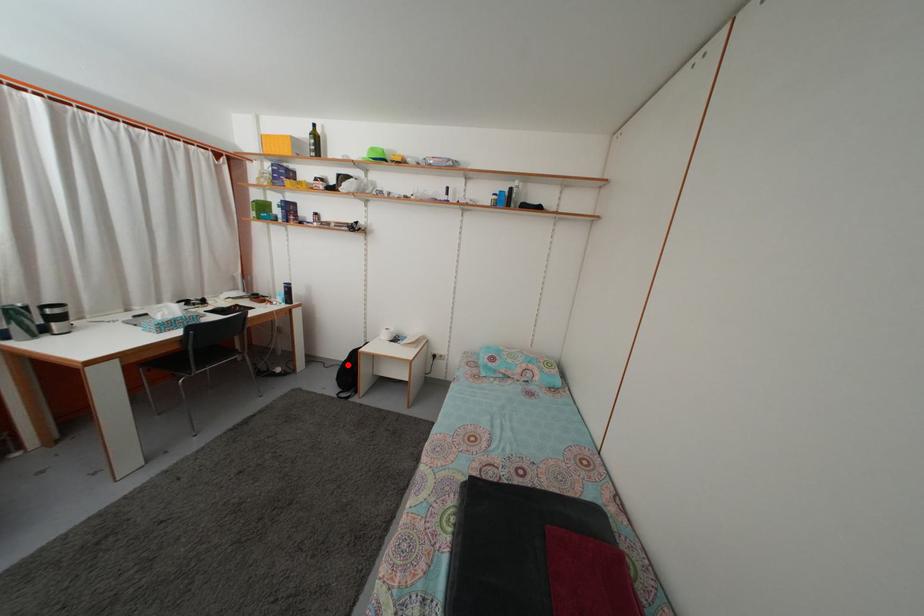
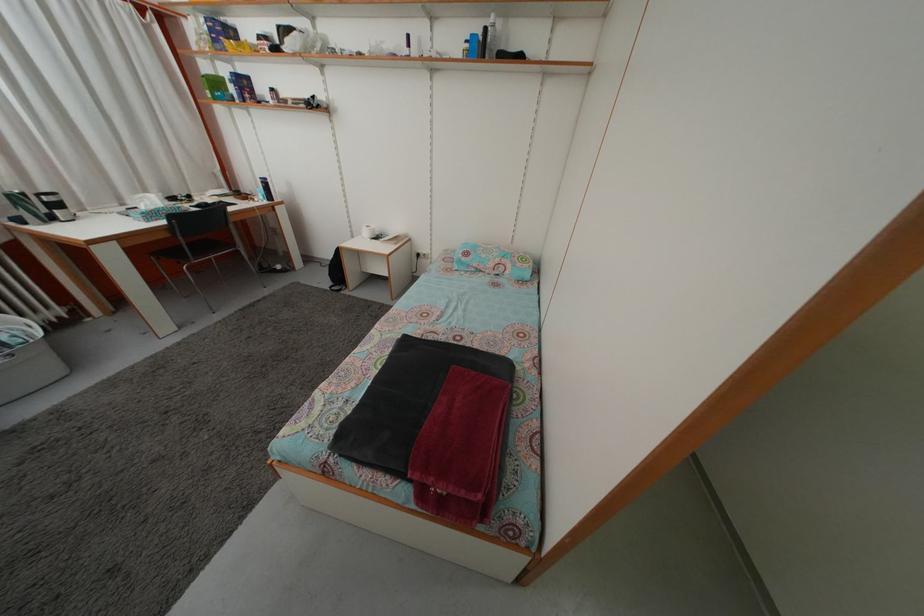
Question: I am providing you with two images of the same scene from different viewpoints. In image1, a red point is highlighted. Considering the same 3D point in image2, which of the following is correct?

Choices:
 (A) It is closer
 (B) It is farther

Answer: (A)